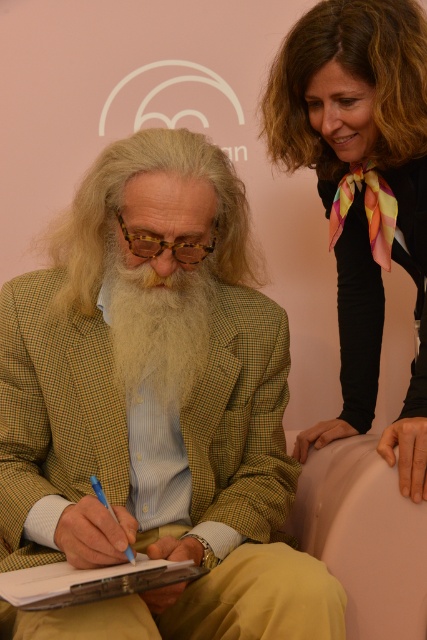
Is point (201, 328) behind point (90, 476)?

Yes.

Is point (155, 316) less distant than point (99, 497)?

No.

Locate an element on the screen. Image resolution: width=427 pixels, height=640 pixels. golden textured beard at center is located at coordinates (157, 326).

Is golden textured beard at center smaller than matte paper clipboard at lower left?

No.

Is golden textured beard at center positioned in front of matte paper clipboard at lower left?

No, it is behind matte paper clipboard at lower left.

Between point (172, 298) and point (99, 582), which one is positioned in front?

Point (99, 582) is in front.

The image size is (427, 640). What are the coordinates of `golden textured beard at center` in the screenshot? It's located at (157, 326).

Is green checkered suit at center shorter than smooth beige armchair at lower center?

No.

Who is more forward, (245, 365) or (417, 524)?

Point (417, 524)

This screenshot has width=427, height=640. In order to click on green checkered suit at center in this screenshot , I will do click(155, 406).

The width and height of the screenshot is (427, 640). In order to click on green checkered suit at center in this screenshot , I will do pos(155,406).